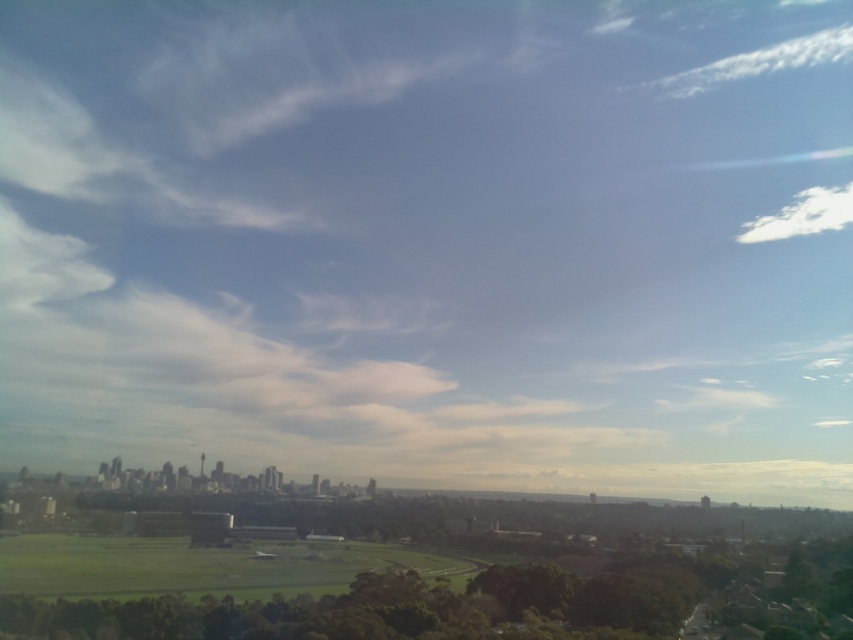
Between green leafy tree at lower center and white fluffy cloud at upper right, which one is positioned higher?

white fluffy cloud at upper right

Between green leafy tree at lower center and white fluffy cloud at upper right, which one has less height?

green leafy tree at lower center is shorter.

Between point (335, 621) and point (788, 228), which one is positioned in front?

Point (335, 621) is in front.

At what (x,y) coordinates should I click in order to perform the action: click on green leafy tree at lower center. Please return your answer as a coordinate pair (x, y). This screenshot has height=640, width=853. Looking at the image, I should click on (490, 604).